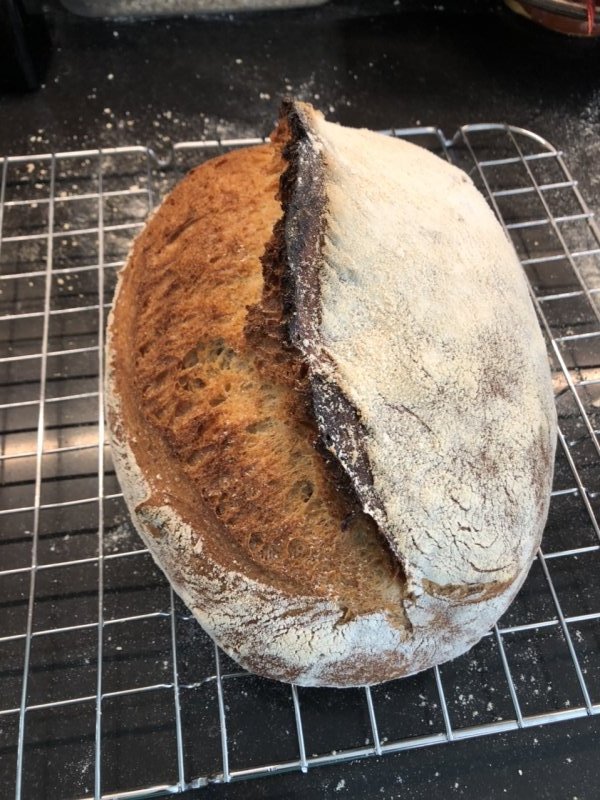
Locate an element on the screen. The width and height of the screenshot is (600, 800). front edge of wire rack is located at coordinates (261, 773), (348, 758), (431, 742), (496, 729), (561, 717).